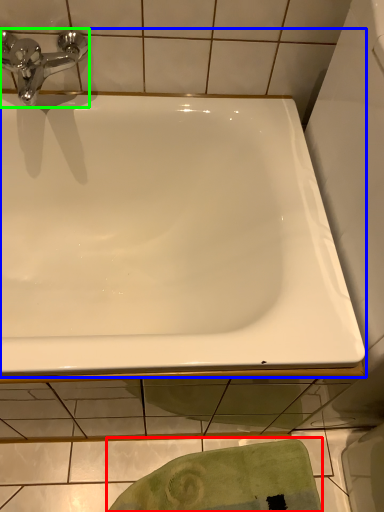
Question: Based on their relative distances, which object is nearer to bath towel (highlighted by a red box)? Choose from bathtub (highlighted by a blue box) and tap (highlighted by a green box).

Choices:
 (A) bathtub
 (B) tap

Answer: (A)